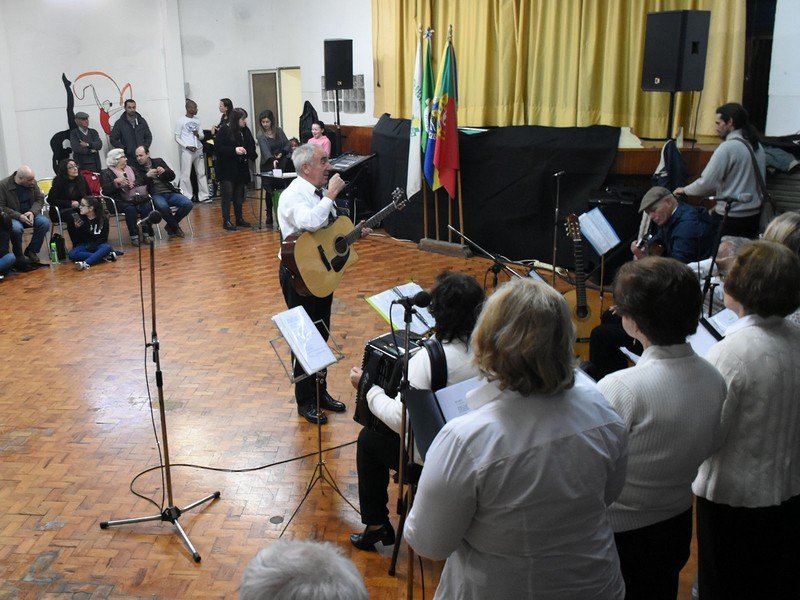
This screenshot has height=600, width=800. I want to click on speaker, so click(x=666, y=30), click(x=338, y=51).